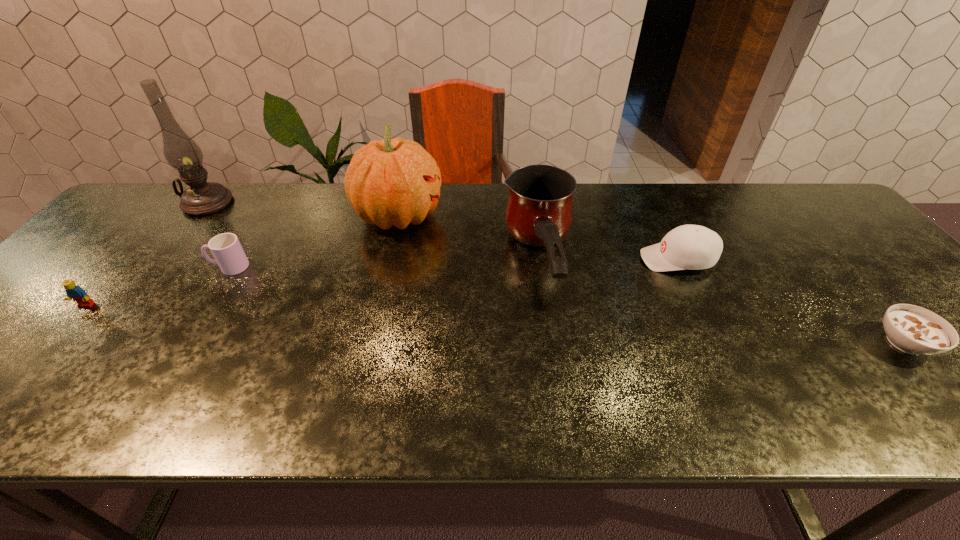
Where is `free space located on the left of the shortest object`? free space located on the left of the shortest object is located at coordinates (807, 342).

The image size is (960, 540). Find the location of `oil lamp at the far edge`. oil lamp at the far edge is located at coordinates (182, 153).

Find the location of a particular element. pumpkin that is at the far edge is located at coordinates (390, 182).

The height and width of the screenshot is (540, 960). What are the coordinates of `saucepan that is positioned at the far edge` in the screenshot? It's located at (539, 211).

Where is `oil lamp situated at the left edge`? The width and height of the screenshot is (960, 540). oil lamp situated at the left edge is located at coordinates (182, 153).

Find the location of a particular element. The width and height of the screenshot is (960, 540). Lego that is at the left edge is located at coordinates (73, 291).

At what (x,y) coordinates should I click in order to perform the action: click on object present at the right edge. Please return your answer as a coordinate pair (x, y). The width and height of the screenshot is (960, 540). Looking at the image, I should click on (912, 329).

Find the location of `object that is at the far left corner`. object that is at the far left corner is located at coordinates pos(182,153).

At what (x,y) coordinates should I click in order to perform the action: click on vacant space at the far edge of the desktop. Please return your answer as a coordinate pair (x, y). Looking at the image, I should click on (229, 229).

Find the location of `free region at the near edge of the desktop`. free region at the near edge of the desktop is located at coordinates (369, 426).